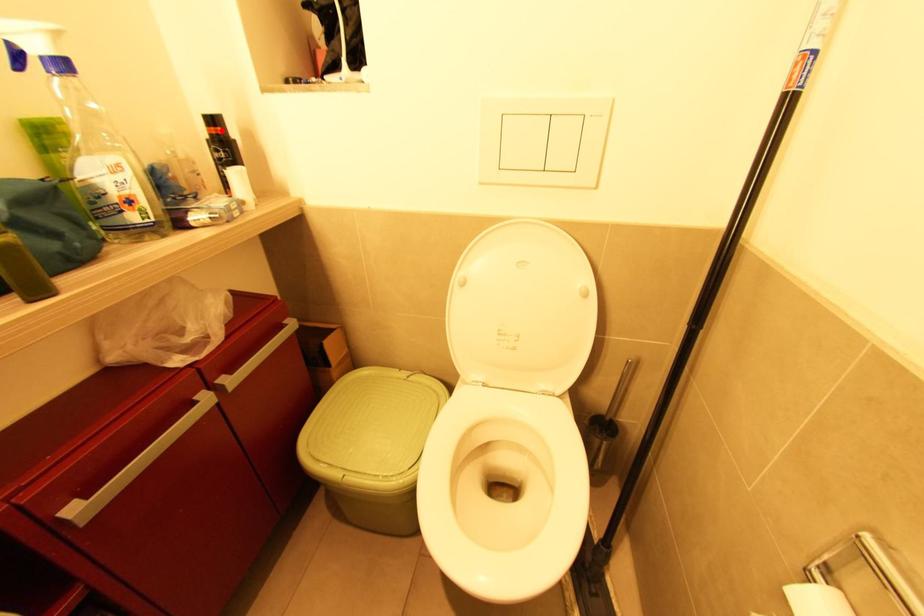
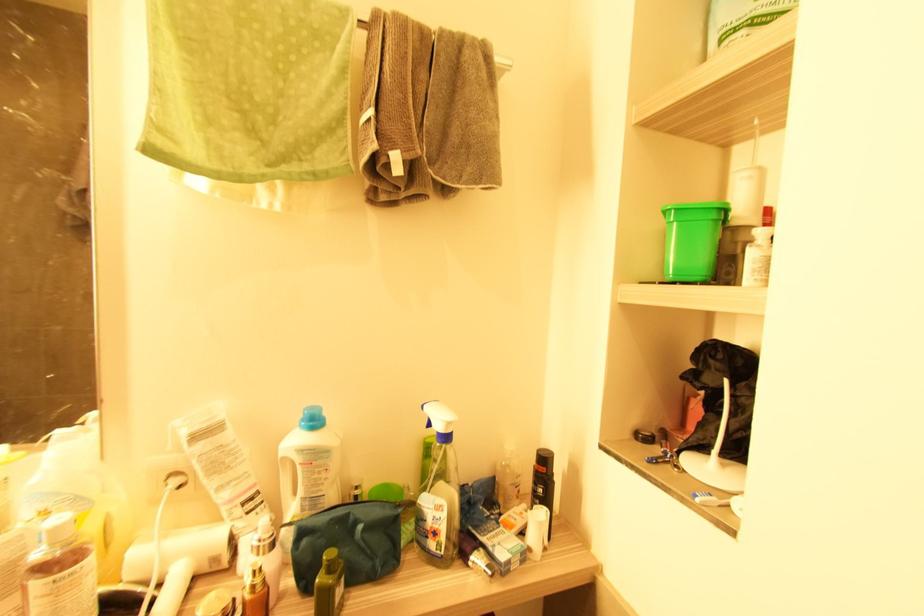
Find the pixel in the second image that matches the highlighted location in the first image.

(545, 469)